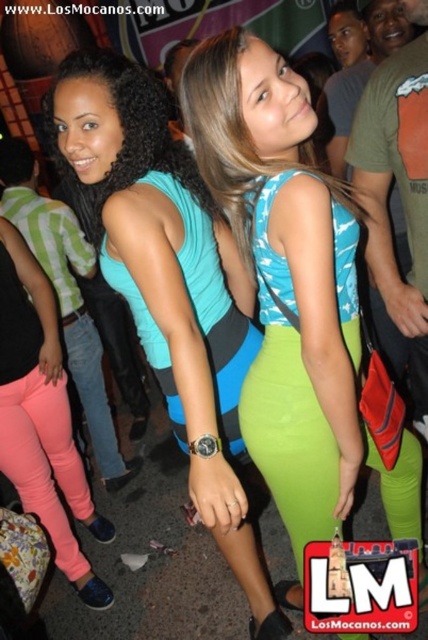
Does blue fabric dress at center have a greater width compared to pink matte leggings at lower left?

Correct, the width of blue fabric dress at center exceeds that of pink matte leggings at lower left.

Does blue fabric dress at center have a greater height compared to pink matte leggings at lower left?

Indeed, blue fabric dress at center has a greater height compared to pink matte leggings at lower left.

Which is behind, point (259, 136) or point (79, 360)?

The point (79, 360) is behind.

Find the location of a particular element. blue fabric dress at center is located at coordinates (294, 291).

Which is above, teal fabric dress at center or pink matte leggings at lower left?

Answer: Positioned higher is teal fabric dress at center.

Which is more to the left, teal fabric dress at center or pink matte leggings at lower left?

pink matte leggings at lower left

This screenshot has width=428, height=640. I want to click on teal fabric dress at center, so click(x=168, y=282).

This screenshot has height=640, width=428. I want to click on teal fabric dress at center, so click(168, 282).

Between blue fabric dress at center and teal fabric dress at center, which one appears on the right side from the viewer's perspective?

blue fabric dress at center

Is point (365, 636) positioned before point (118, 131)?

No, it is not.

This screenshot has height=640, width=428. What do you see at coordinates (294, 291) in the screenshot?
I see `blue fabric dress at center` at bounding box center [294, 291].

You are a GUI agent. You are given a task and a screenshot of the screen. Output one action in this format:
    pyautogui.click(x=<x>, y=<y>)
    Task: Click on the blue fabric dress at center
    This screenshot has width=428, height=640.
    Given the screenshot: What is the action you would take?
    pyautogui.click(x=294, y=291)